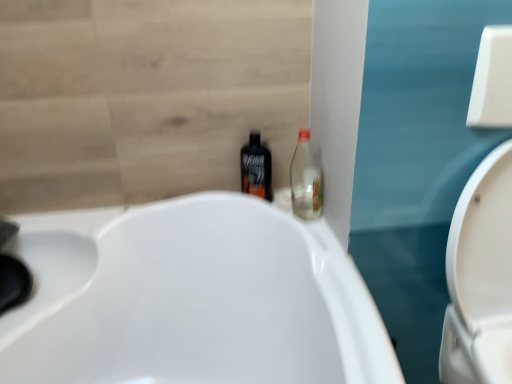
Question: Is black plastic bottle at center, the 1th bottle positioned from the left, facing away from white glossy toilet at right?

Choices:
 (A) no
 (B) yes

Answer: (A)

Question: From a real-world perspective, is black plastic bottle at center, the 1th bottle positioned from the left, below white glossy toilet at right?

Choices:
 (A) no
 (B) yes

Answer: (A)

Question: Considering the relative sizes of black plastic bottle at center, the 1th bottle positioned from the left, and white glossy toilet at right in the image provided, is black plastic bottle at center, the 1th bottle positioned from the left, smaller than white glossy toilet at right?

Choices:
 (A) no
 (B) yes

Answer: (B)

Question: Can you confirm if black plastic bottle at center, the 1th bottle positioned from the left, is bigger than white glossy toilet at right?

Choices:
 (A) no
 (B) yes

Answer: (A)

Question: From the image's perspective, is black plastic bottle at center, the second bottle from the right, located beneath white glossy toilet at right?

Choices:
 (A) no
 (B) yes

Answer: (A)

Question: From a real-world perspective, is white glossy toilet at right physically located above or below transparent glass bottle at center-right, the 1th bottle from the right?

Choices:
 (A) above
 (B) below

Answer: (B)

Question: From the image's perspective, is white glossy toilet at right above or below transparent glass bottle at center-right, the 1th bottle from the right?

Choices:
 (A) above
 (B) below

Answer: (B)

Question: Is point (475, 362) closer or farther from the camera than point (295, 165)?

Choices:
 (A) farther
 (B) closer

Answer: (B)

Question: Considering the positions of white glossy toilet at right and transparent glass bottle at center-right, the 1th bottle from the right, in the image, is white glossy toilet at right taller or shorter than transparent glass bottle at center-right, the 1th bottle from the right,?

Choices:
 (A) short
 (B) tall

Answer: (B)

Question: Does point (478, 291) appear closer or farther from the camera than point (241, 162)?

Choices:
 (A) farther
 (B) closer

Answer: (B)

Question: Considering the positions of white glossy toilet at right and black plastic bottle at center, the second bottle from the right, in the image, is white glossy toilet at right wider or thinner than black plastic bottle at center, the second bottle from the right,?

Choices:
 (A) wide
 (B) thin

Answer: (A)

Question: From the image's perspective, relative to black plastic bottle at center, the 1th bottle positioned from the left, is white glossy toilet at right above or below?

Choices:
 (A) below
 (B) above

Answer: (A)

Question: In the image, is white glossy toilet at right on the left side or the right side of black plastic bottle at center, the second bottle from the right?

Choices:
 (A) left
 (B) right

Answer: (B)

Question: Based on their sizes in the image, would you say transparent glass bottle at center-right, arranged as the 2th bottle when viewed from the left, is bigger or smaller than black plastic bottle at center, the second bottle from the right?

Choices:
 (A) big
 (B) small

Answer: (A)

Question: Is transparent glass bottle at center-right, arranged as the 2th bottle when viewed from the left, spatially inside black plastic bottle at center, the 1th bottle positioned from the left, or outside of it?

Choices:
 (A) inside
 (B) outside

Answer: (B)